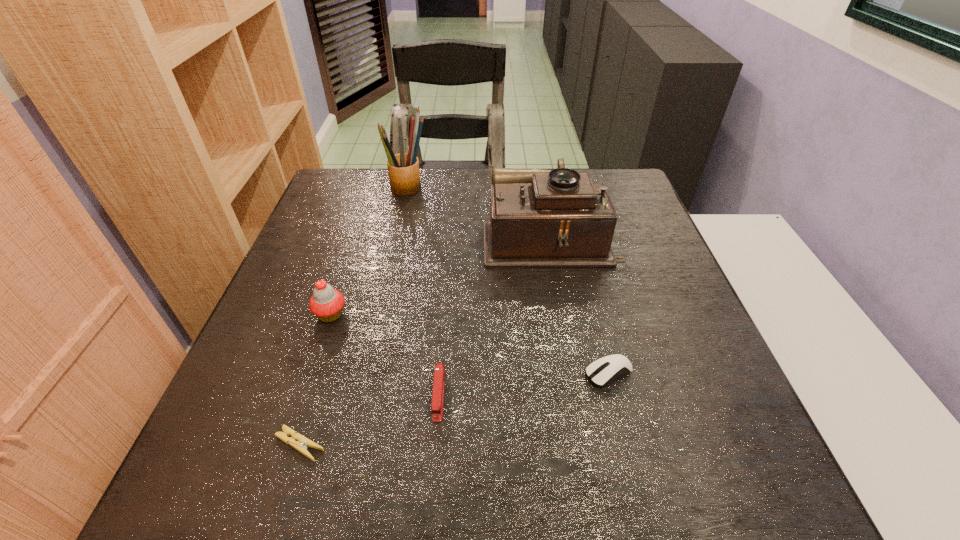
Locate an element on the screen. The image size is (960, 540). free space located 0.360m on the horn of the phonograph_record is located at coordinates (342, 236).

Locate an element on the screen. The height and width of the screenshot is (540, 960). free space located 0.100m on the horn of the phonograph_record is located at coordinates (444, 236).

Locate an element on the screen. The height and width of the screenshot is (540, 960). vacant space located 0.050m on the horn of the phonograph_record is located at coordinates (464, 236).

In order to click on blank space located on the front of the cupcake in this screenshot , I will do [x=299, y=412].

This screenshot has width=960, height=540. Identify the location of vacant space located 0.100m on the front-facing side of the third object from right to left. (432, 482).

Identify the location of free spot located 0.180m on the front of the fifth tallest object. (639, 494).

Find the location of a particular element. This screenshot has width=960, height=540. blank space located 0.160m on the back of the clothespin is located at coordinates (329, 351).

Identify the location of pencil box positioned at the far edge. (403, 169).

You are a GUI agent. You are given a task and a screenshot of the screen. Output one action in this format:
    pyautogui.click(x=<x>, y=<y>)
    Task: Click on the phonograph_record at the far edge
    The width and height of the screenshot is (960, 540).
    Given the screenshot: What is the action you would take?
    pyautogui.click(x=558, y=218)

The image size is (960, 540). I want to click on object situated at the near edge, so click(x=301, y=446).